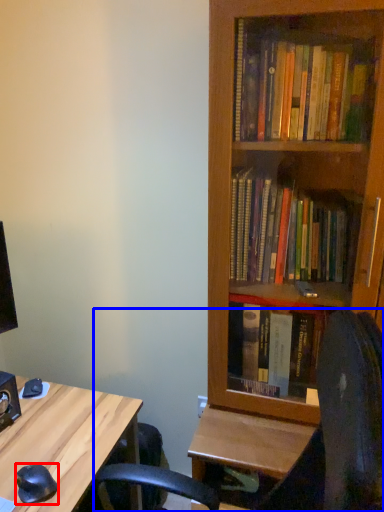
Question: Among these objects, which one is nearest to the camera, mouse (highlighted by a red box) or computer chair (highlighted by a blue box)?

Choices:
 (A) mouse
 (B) computer chair

Answer: (B)